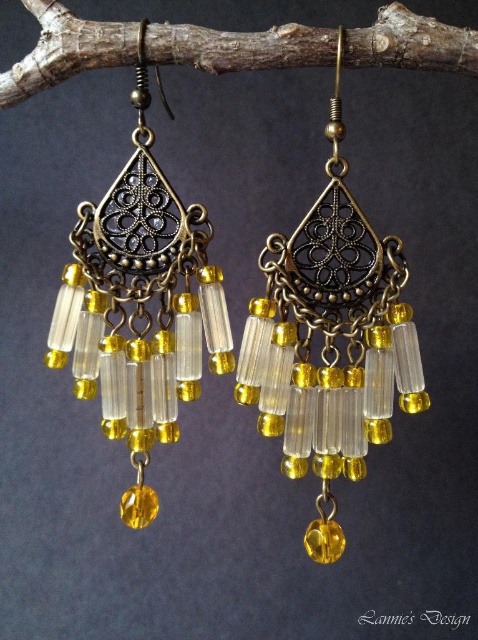
Question: Can you confirm if antique brass earrings at center is bigger than antique gold metal chandelier earrings at center?

Choices:
 (A) no
 (B) yes

Answer: (B)

Question: From the image, what is the correct spatial relationship of antique gold metal chandelier earrings at center in relation to brown wood at upper center?

Choices:
 (A) above
 (B) below

Answer: (B)

Question: Among these objects, which one is nearest to the camera?

Choices:
 (A) antique brass earrings at center
 (B) antique gold metal chandelier earrings at center
 (C) brown wood at upper center

Answer: (A)

Question: Does antique brass earrings at center have a larger size compared to antique gold metal chandelier earrings at center?

Choices:
 (A) no
 (B) yes

Answer: (B)

Question: Which point is farther from the camera taking this photo?

Choices:
 (A) (291, 369)
 (B) (411, 24)

Answer: (A)

Question: Which object is positioned farthest from the antique gold metal chandelier earrings at center?

Choices:
 (A) brown wood at upper center
 (B) antique brass earrings at center

Answer: (A)